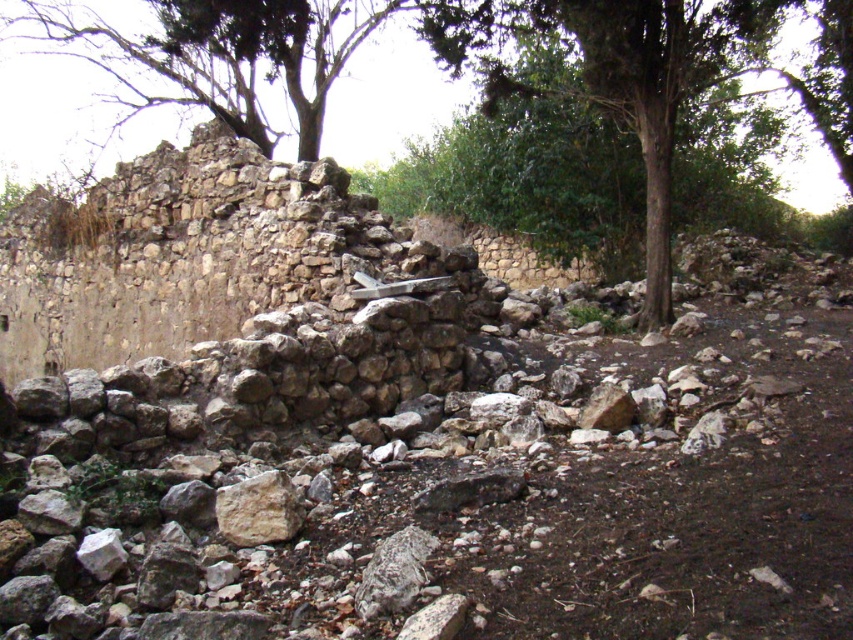
You are an archaeologist examining the ancient stone structure. You notice the green leafy tree at upper center and the smooth beige rock at center. Which object is bigger in size?

The green leafy tree at upper center is larger in size compared to the smooth beige rock at center.